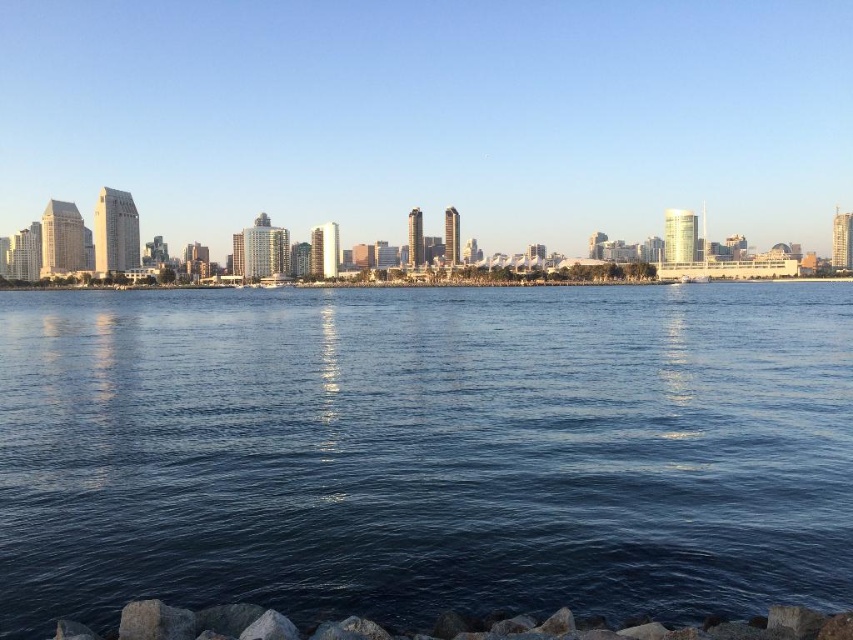
Question: Does blue liquid water at center have a smaller size compared to gray rock at lower center?

Choices:
 (A) no
 (B) yes

Answer: (A)

Question: Which point is farther to the camera?

Choices:
 (A) blue liquid water at center
 (B) gray rock at lower center

Answer: (A)

Question: Can you confirm if blue liquid water at center is smaller than gray rock at lower center?

Choices:
 (A) no
 (B) yes

Answer: (A)

Question: Is blue liquid water at center smaller than gray rock at lower center?

Choices:
 (A) yes
 (B) no

Answer: (B)

Question: Which object appears closest to the camera in this image?

Choices:
 (A) blue liquid water at center
 (B) gray rock at lower center

Answer: (B)